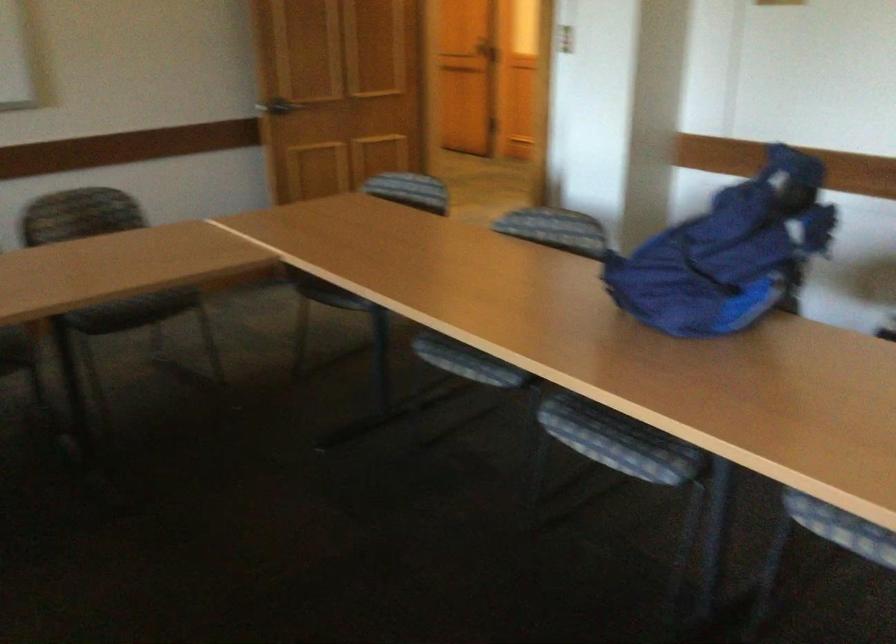
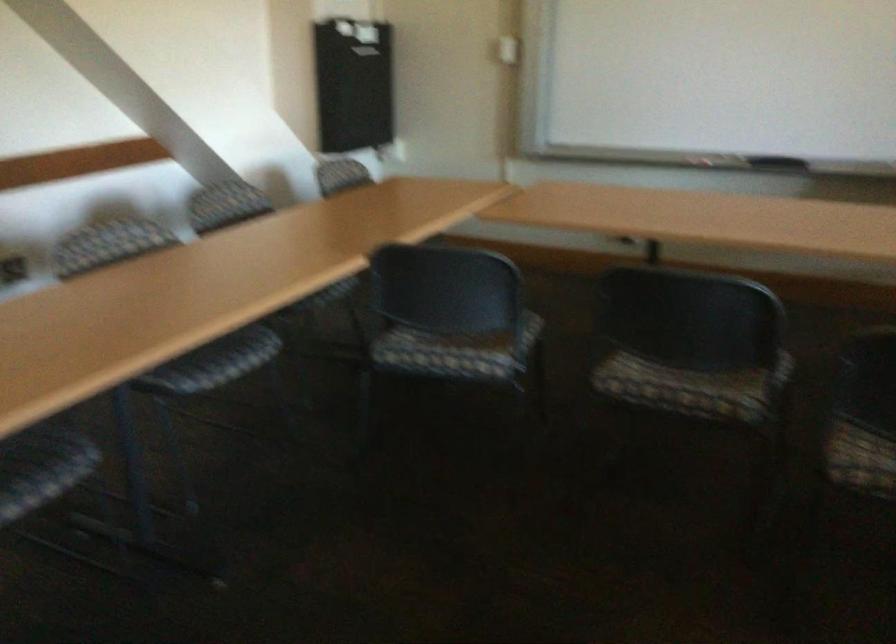
First-person continuous shooting, in which direction is the camera rotating?

The rotation direction of the camera is right-down.